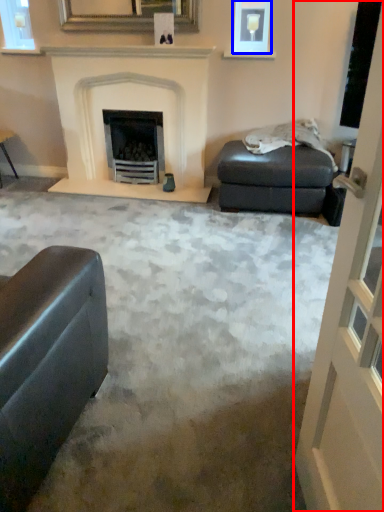
Question: Which object appears farthest to the camera in this image, screen door (highlighted by a red box) or picture frame (highlighted by a blue box)?

Choices:
 (A) screen door
 (B) picture frame

Answer: (B)